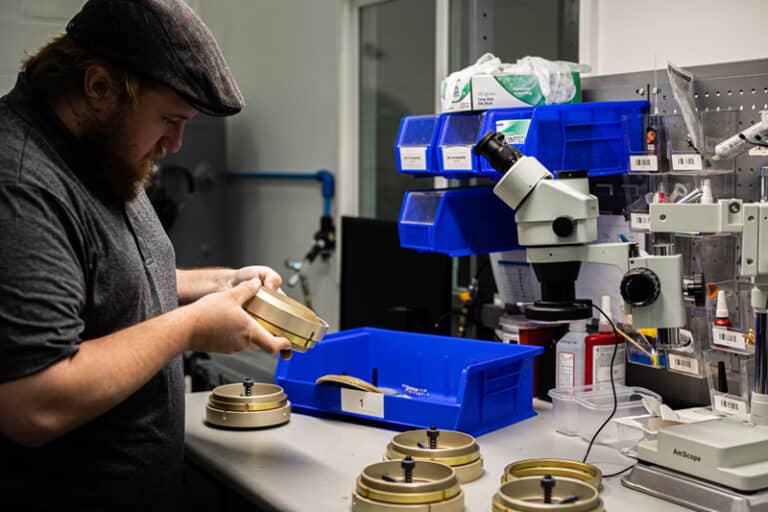
At what (x,y) coordinates should I click in order to perform the action: click on desk. Please return your answer as a coordinate pair (x, y). This screenshot has width=768, height=512. Looking at the image, I should click on (326, 454).